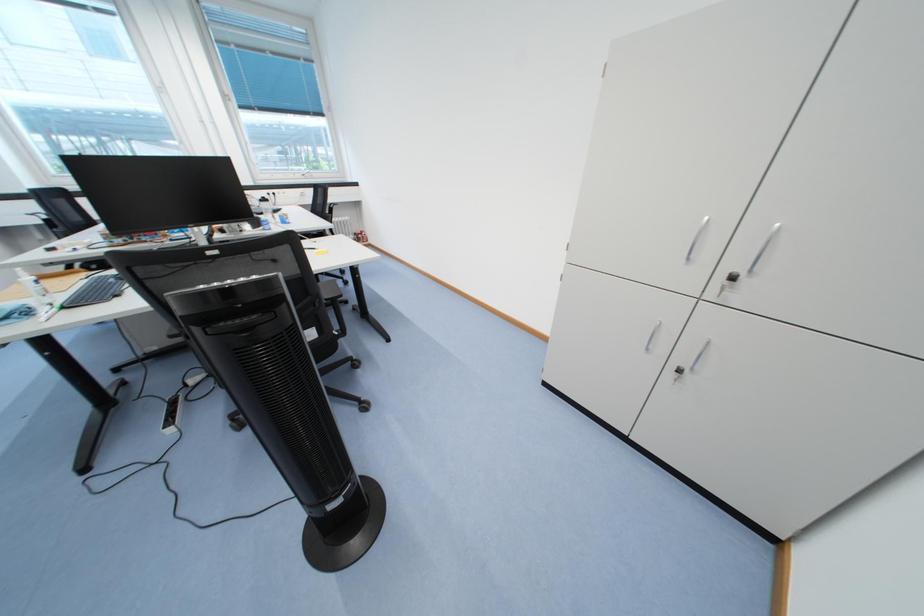
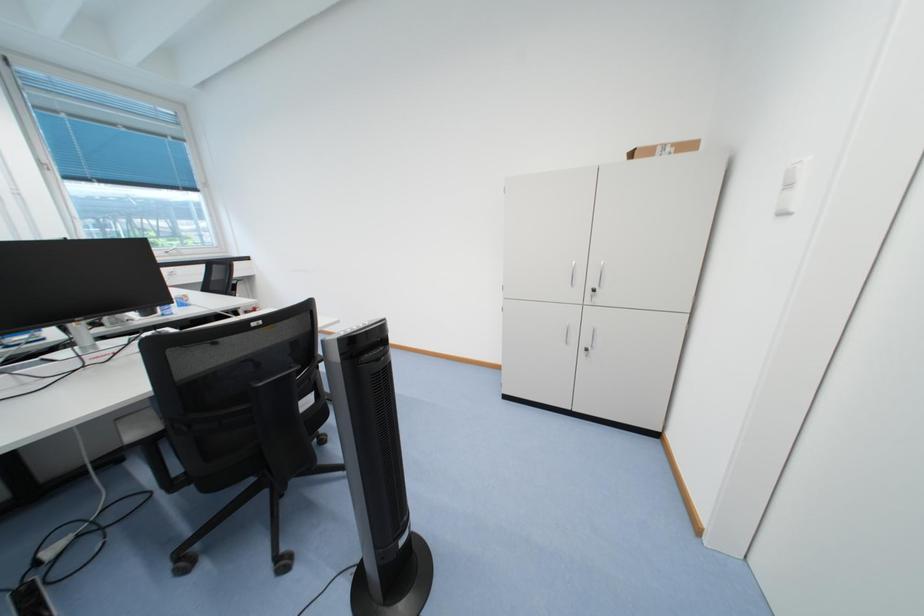
Based on the photo, in a continuous first-person perspective shot, in which direction is the camera moving?

The cameraman moved toward left, backward.